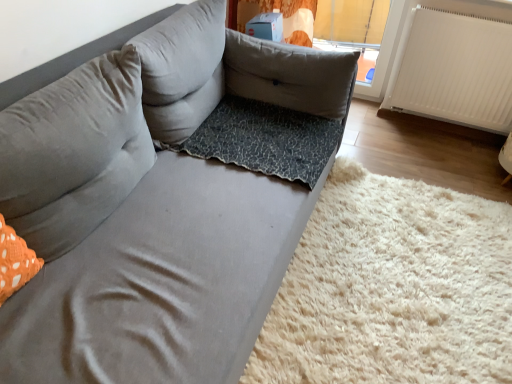
Question: In terms of height, does leopard print cushion at center, placed as the first pillow when sorted from right to left, look taller or shorter compared to gray fabric pillow at upper left, which is counted as the third pillow, starting from the right?

Choices:
 (A) tall
 (B) short

Answer: (B)

Question: Is leopard print cushion at center, which appears as the third pillow when viewed from the left, spatially inside gray fabric pillow at upper left, which is counted as the third pillow, starting from the right, or outside of it?

Choices:
 (A) inside
 (B) outside

Answer: (B)

Question: Which object is positioned farthest from the suede gray couch at center?

Choices:
 (A) leopard print cushion at center, which appears as the third pillow when viewed from the left
 (B) white ribbed radiator at right
 (C) gray fabric pillow at upper left, which is counted as the 1th pillow, starting from the left
 (D) leopard print fabric at lower right
 (E) leopard print fabric dog bed at center

Answer: (B)

Question: Considering the real-world distances, which object is farthest from the gray fabric pillow at center, arranged as the second pillow when viewed from the right?

Choices:
 (A) suede gray couch at center
 (B) leopard print fabric at lower right
 (C) leopard print fabric dog bed at center
 (D) leopard print cushion at center, which appears as the third pillow when viewed from the left
 (E) gray fabric pillow at upper left, which is counted as the third pillow, starting from the right

Answer: (B)